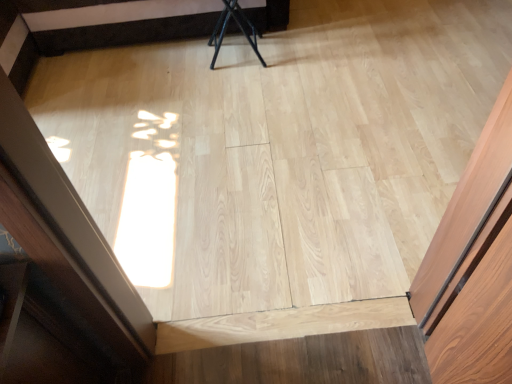
The image size is (512, 384). Identify the location of free spot in front of black metal tripod at upper center. (241, 88).